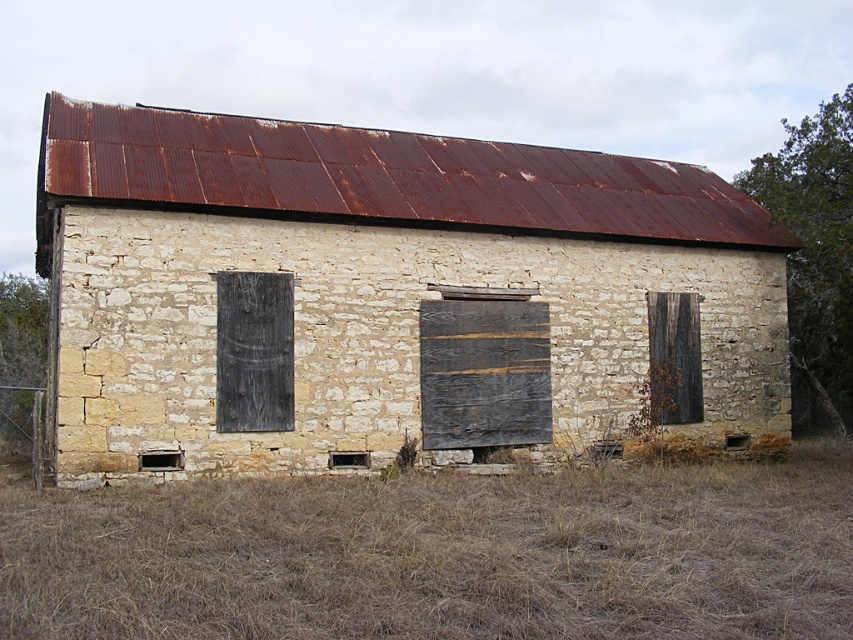
Question: Estimate the real-world distances between objects in this image. Which object is closer to the brown grass at lower center?

Choices:
 (A) weathered wood door at center
 (B) rusty corrugated metal roof at upper center

Answer: (A)

Question: Is weathered wood door at center to the right of dark gray wood shutter at center left from the viewer's perspective?

Choices:
 (A) yes
 (B) no

Answer: (A)

Question: Which of the following is the closest to the observer?

Choices:
 (A) (605, 355)
 (B) (247, 337)
 (C) (666, 330)
 (D) (448, 417)

Answer: (B)

Question: Is brown grass at lower center closer to camera compared to dark brown wooden door at right?

Choices:
 (A) yes
 (B) no

Answer: (A)

Question: Based on their relative distances, which object is farther from the brown grass at lower center?

Choices:
 (A) dark brown wooden door at right
 (B) weathered wood door at center
 (C) dark gray wood shutter at center left

Answer: (A)

Question: Does brown grass at lower center appear over weathered wood door at center?

Choices:
 (A) yes
 (B) no

Answer: (B)